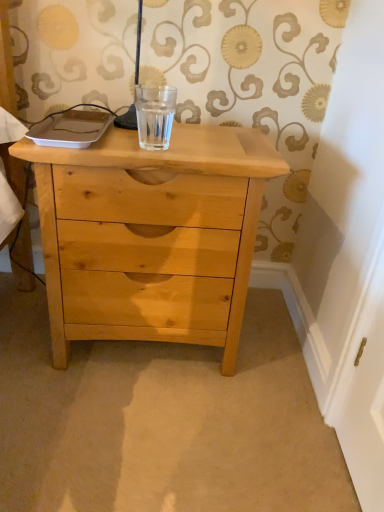
Question: From a real-world perspective, is clear glass water at center above or below natural wood chest of drawers at center?

Choices:
 (A) below
 (B) above

Answer: (B)

Question: From their relative heights in the image, would you say clear glass water at center is taller or shorter than natural wood chest of drawers at center?

Choices:
 (A) short
 (B) tall

Answer: (A)

Question: From the image's perspective, is clear glass water at center above or below natural wood chest of drawers at center?

Choices:
 (A) below
 (B) above

Answer: (B)

Question: Does point click(x=120, y=257) appear closer or farther from the camera than point click(x=155, y=129)?

Choices:
 (A) closer
 (B) farther

Answer: (A)

Question: Looking at their shapes, would you say natural wood chest of drawers at center is wider or thinner than clear glass water at center?

Choices:
 (A) wide
 (B) thin

Answer: (A)

Question: From the image's perspective, is natural wood chest of drawers at center located above or below clear glass water at center?

Choices:
 (A) above
 (B) below

Answer: (B)

Question: Considering the relative positions of natural wood chest of drawers at center and clear glass water at center in the image provided, is natural wood chest of drawers at center to the left or to the right of clear glass water at center?

Choices:
 (A) right
 (B) left

Answer: (B)